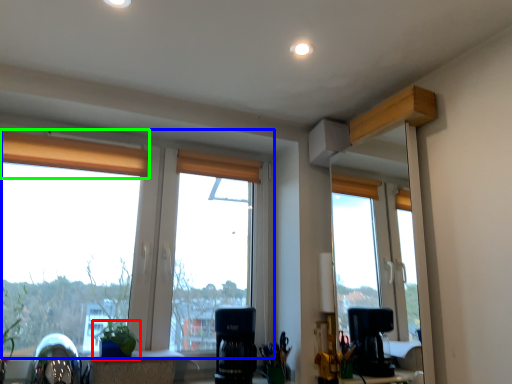
Question: Estimate the real-world distances between objects in this image. Which object is farther from houseplant (highlighted by a red box), window (highlighted by a blue box) or curtain (highlighted by a green box)?

Choices:
 (A) window
 (B) curtain

Answer: (B)